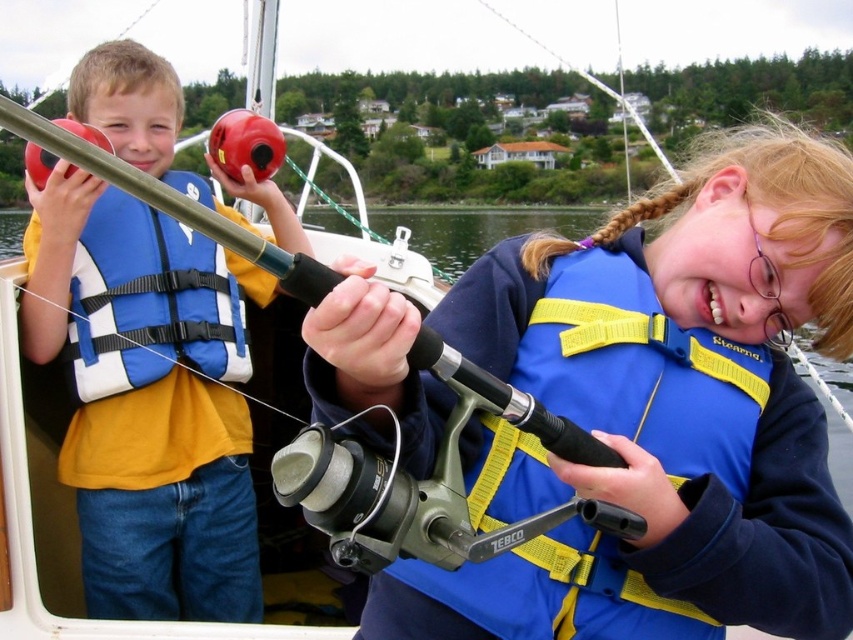
You are on a boat with two children. There are two points marked on the boat. The first point is at coordinates point (138, 596) and the second point is at point (701, 365). If you are facing the front of the boat, which point is closer to the back of the boat?

A: Point (138, 596) is behind point (701, 365), so it is closer to the back of the boat.

You are standing at point (216, 518) and want to take a photo of the children fishing. The camera you have can focus on objects up to 4 meters away. Can you take a clear photo of the children from this position?

The distance between point (216, 518) and the camera is 3.80 meters, which is within the camera focus range of 4 meters. Therefore, you can take a clear photo of the children from this position.